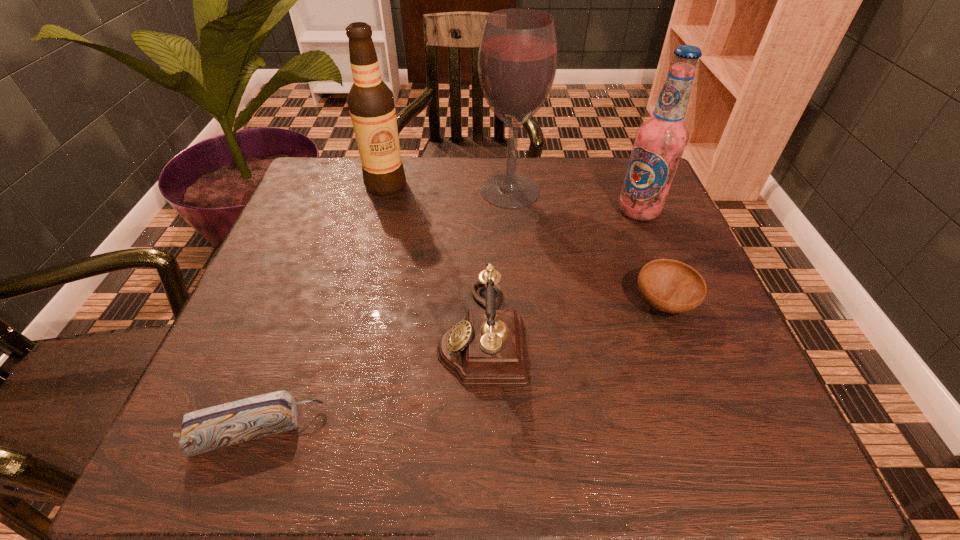
Where is `vacant region between the third shortest object and the leftmost alcohol`? vacant region between the third shortest object and the leftmost alcohol is located at coordinates point(434,259).

At what (x,y) coordinates should I click in order to perform the action: click on vacant space that is in between the telephone and the nearest object. Please return your answer as a coordinate pair (x, y). The height and width of the screenshot is (540, 960). Looking at the image, I should click on (369, 381).

Image resolution: width=960 pixels, height=540 pixels. Identify the location of empty space that is in between the rightmost alcohol and the third shortest object. (560, 271).

Where is `free spot between the rightmost alcohol and the second alcohol from left to right`? The width and height of the screenshot is (960, 540). free spot between the rightmost alcohol and the second alcohol from left to right is located at coordinates (574, 201).

Identify which object is the second closest to the leftmost alcohol. Please provide its 2D coordinates. Your answer should be formatted as a tuple, i.e. [(x, y)], where the tuple contains the x and y coordinates of a point satisfying the conditions above.

[(487, 347)]

Find the location of `the second closest object to the leftmost alcohol`. the second closest object to the leftmost alcohol is located at coordinates (487, 347).

Identify the location of the closest alcohol relative to the nearest object. (370, 101).

Where is `alcohol identified as the closest to the rightmost alcohol`? The height and width of the screenshot is (540, 960). alcohol identified as the closest to the rightmost alcohol is located at coordinates (517, 59).

Find the location of a particular element. vacant position in the image that satisfies the following two spatial constraints: 1. on the label of the leftmost alcohol; 2. on the left side of the bowl is located at coordinates (356, 303).

Identify the location of vacant area that satisfies the following two spatial constraints: 1. on the label of the leftmost alcohol; 2. on the right side of the rightmost alcohol. The height and width of the screenshot is (540, 960). (379, 211).